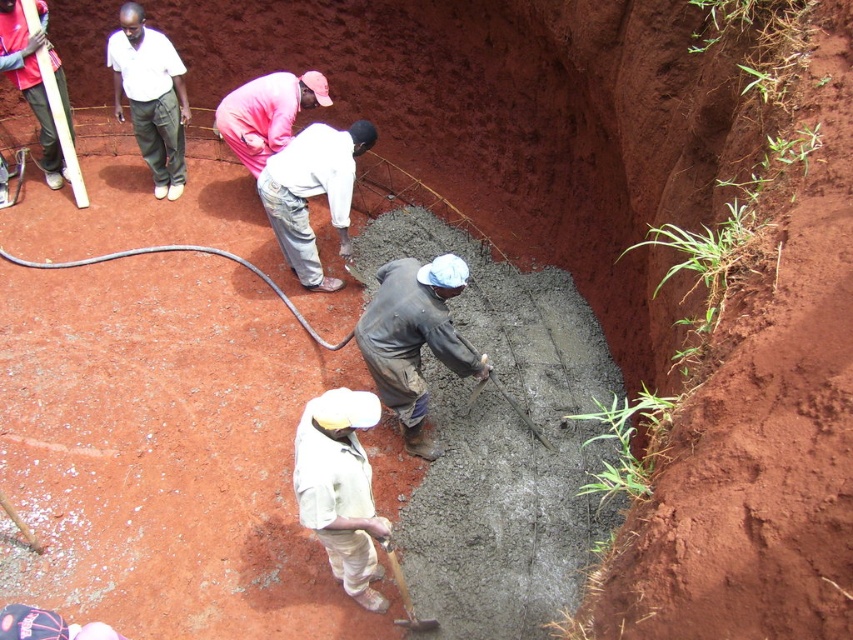
You are observing two workers at a construction site. You notice a white cotton shirt at center and a white cotton shirt at upper left. Which worker is wearing a shirt that appears shorter in the image?

The white cotton shirt at center appears shorter than the white cotton shirt at upper left in the image.

You are a safety inspector observing the construction site. You notice the white cotton shirt at upper left and the wooden handle shovel at lower center. Which object is higher in the image?

The white cotton shirt at upper left is taller than the wooden handle shovel at lower center, so the white cotton shirt at upper left is higher in the image.

Please look at the image and tell me what object is located at the coordinates point (413,339)?

The dark gray uniform at center is located at point (413,339).